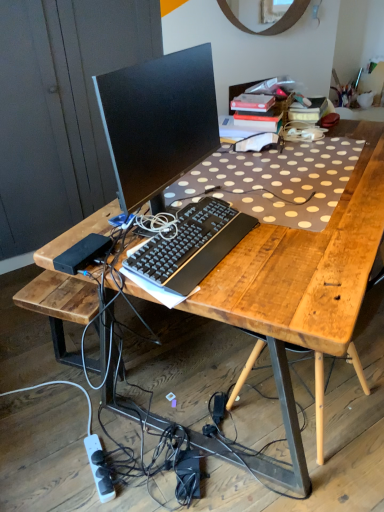
Find the location of a particular element. The image size is (384, 512). vacant space that is in between wooden at right and white plastic power strip at lower left is located at coordinates (183, 438).